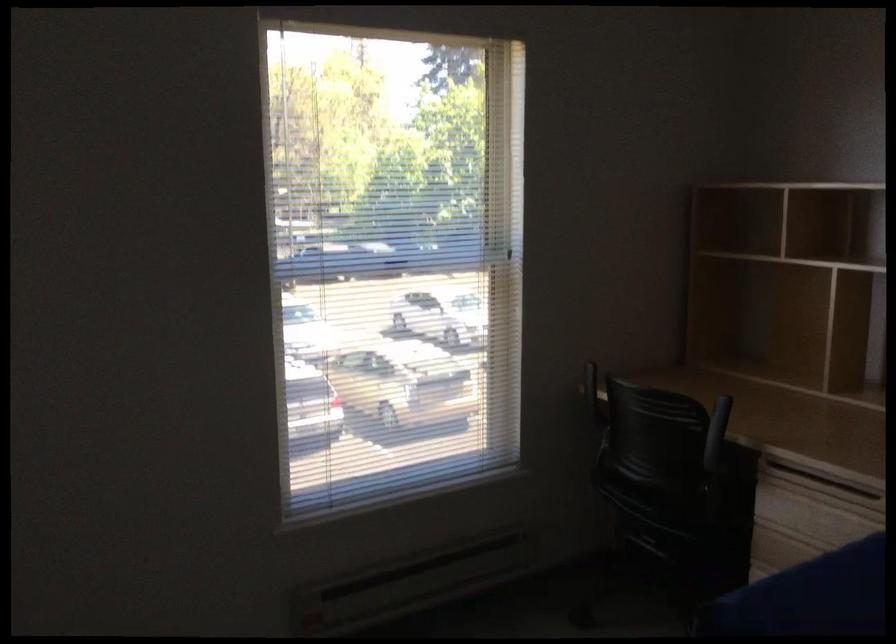
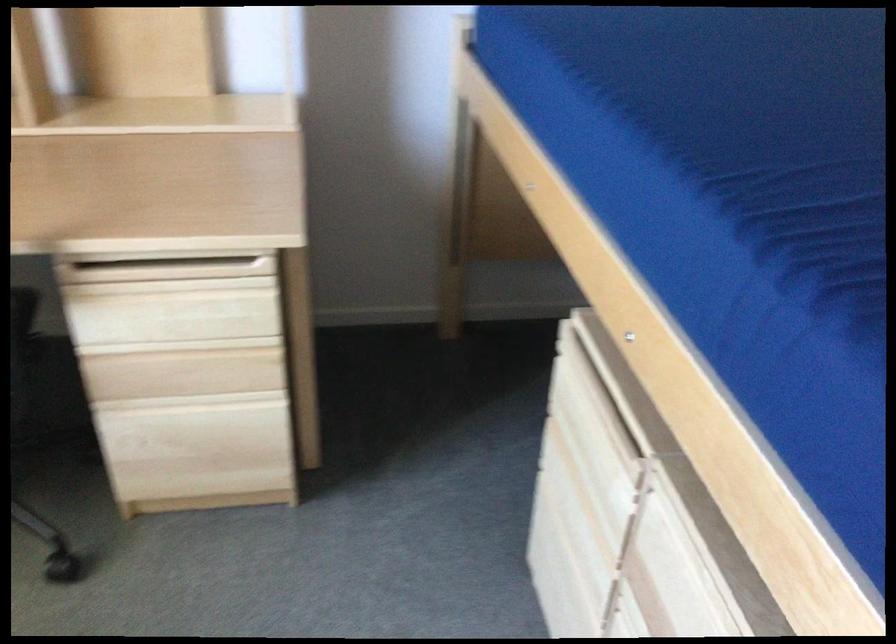
In the second image, find the point that corresponds to (815,556) in the first image.

(179, 346)